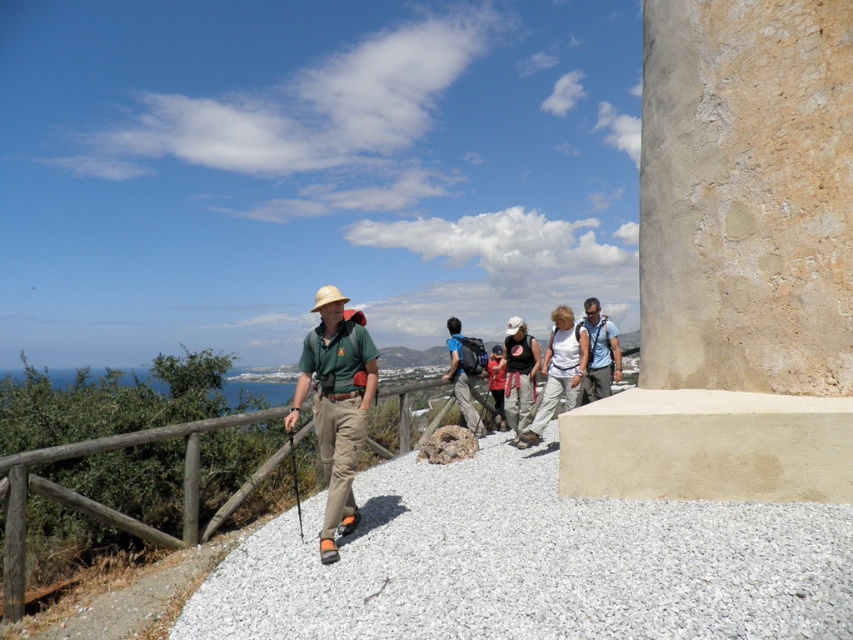
You are a hiker standing on the gravel path and see the wooden at left and the white cotton shirt at center. Which object is smaller in size?

The wooden at left is smaller in size compared to the white cotton shirt at center.

You are a hiker standing on the gravel path. You notice two structures ahead of you. One is the smooth concrete pillar at right and the other is the wooden at left. According to the scene, which structure is located higher up the path compared to the other?

The smooth concrete pillar at right is positioned over the wooden at left, meaning it is higher up the path.

From the picture: You are a hiker standing at the start of the trail and see the two hikers wearing the matte green shirt at center and the matte blue shirt at center. If you want to catch up to them, which one should you aim to reach first?

The matte green shirt at center and the matte blue shirt at center are both ahead of you on the trail. Since the matte green shirt at center is 5.05 meters away from the matte blue shirt at center, you should aim to reach the one that is closer to your starting position. However, without knowing their exact positions relative to your starting point, it is impossible to determine which is closer.